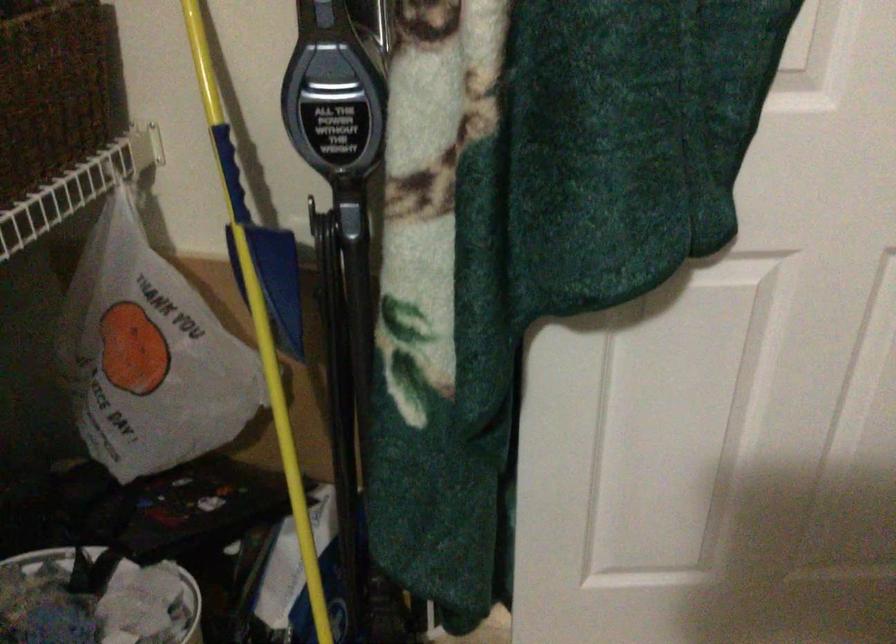
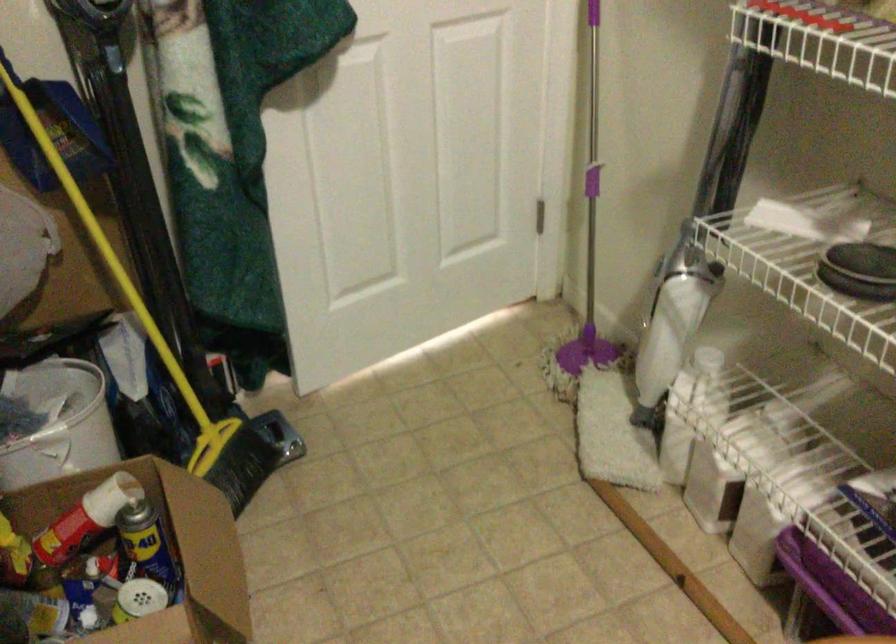
Question: The camera is either moving clockwise (left) or counter-clockwise (right) around the object. The first image is from the beginning of the video and the second image is from the end. Is the camera moving left or right when shooting the video?

Choices:
 (A) Left
 (B) Right

Answer: (A)